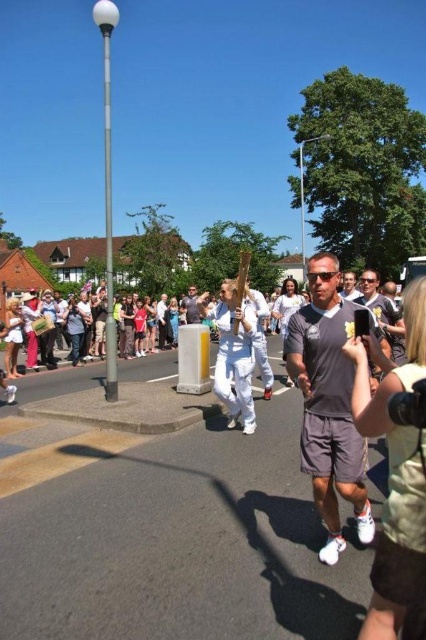
You are a photographer at the event and want to capture both the gray matte shorts at center and the white cotton shirt at center in a single photo. Which object should you position closer to the left side of your camera frame to include both?

To include both the gray matte shorts at center and the white cotton shirt at center in the photo, you should position the white cotton shirt at center closer to the left side of your camera frame since the gray matte shorts at center is on its right side.